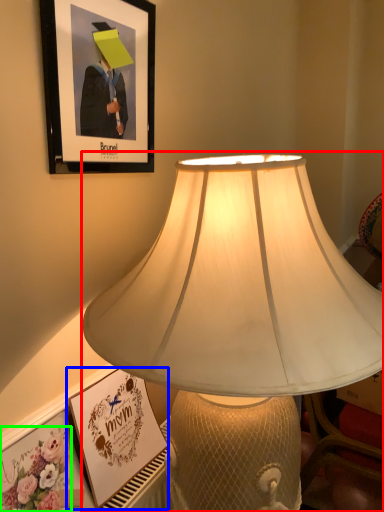
Question: Estimate the real-world distances between objects in this image. Which object is closer to lamp (highlighted by a red box), picture frame (highlighted by a blue box) or flower (highlighted by a green box)?

Choices:
 (A) picture frame
 (B) flower

Answer: (A)